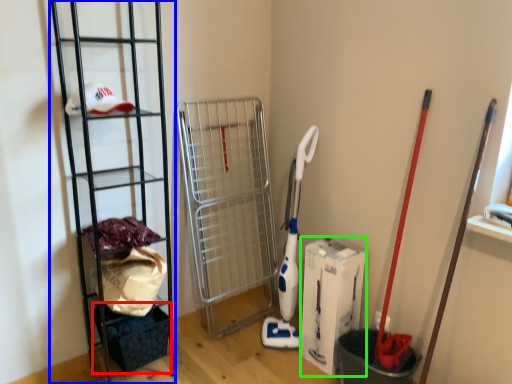
Question: Which object is positioned farthest from basket (highlighted by a red box)? Select from ladder (highlighted by a blue box) and box (highlighted by a green box).

Choices:
 (A) ladder
 (B) box

Answer: (B)